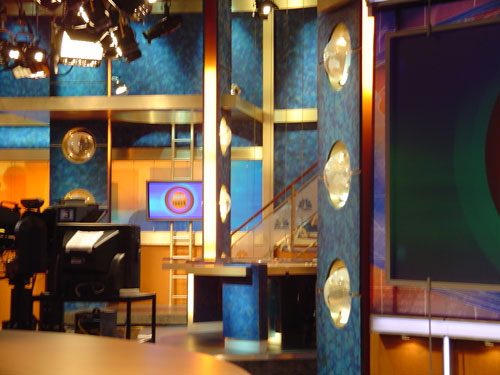
Find the location of a particular element. Image resolution: width=500 pixels, height=375 pixels. wall is located at coordinates (304, 139).